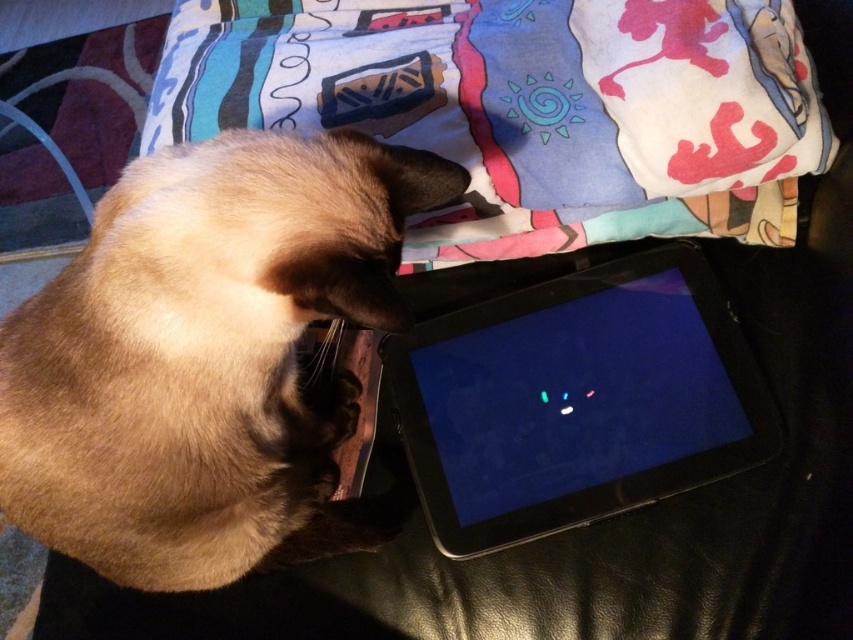
Question: Can you confirm if satin beige cat at lower left is bigger than printed fabric pillow at upper center?

Choices:
 (A) no
 (B) yes

Answer: (A)

Question: Which point appears closest to the camera in this image?

Choices:
 (A) (599, 124)
 (B) (210, 196)

Answer: (B)

Question: Which object is positioned farthest from the satin beige cat at lower left?

Choices:
 (A) printed fabric pillow at upper center
 (B) black matte tablet at center

Answer: (A)

Question: Estimate the real-world distances between objects in this image. Which object is closer to the satin beige cat at lower left?

Choices:
 (A) printed fabric pillow at upper center
 (B) black matte tablet at center

Answer: (B)

Question: Does printed fabric pillow at upper center appear under black matte tablet at center?

Choices:
 (A) no
 (B) yes

Answer: (A)

Question: In this image, where is satin beige cat at lower left located relative to printed fabric pillow at upper center?

Choices:
 (A) above
 (B) below

Answer: (B)